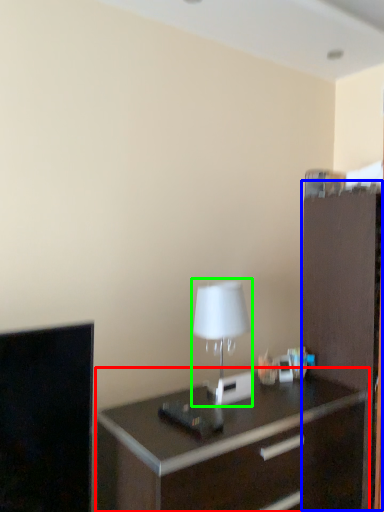
Question: Which object is the farthest from chest of drawers (highlighted by a red box)? Choose among these: file cabinet (highlighted by a blue box) or table lamp (highlighted by a green box).

Choices:
 (A) file cabinet
 (B) table lamp

Answer: (B)